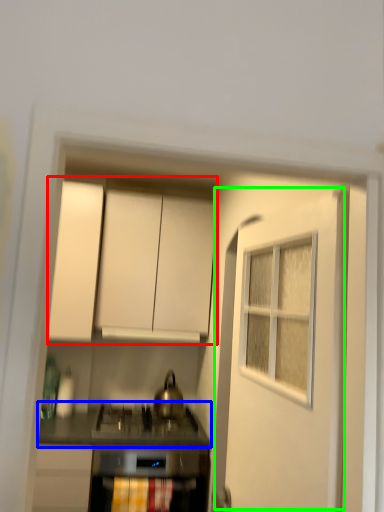
Question: Which is nearer to the cabinetry (highlighted by a red box)? countertop (highlighted by a blue box) or door (highlighted by a green box).

Choices:
 (A) countertop
 (B) door

Answer: (A)